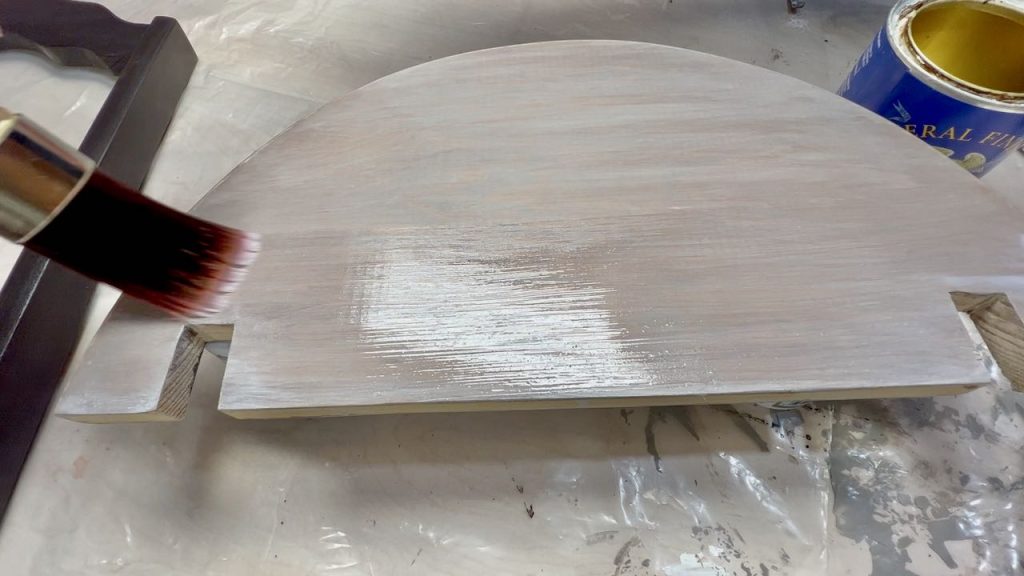
You are a GUI agent. You are given a task and a screenshot of the screen. Output one action in this format:
    pyautogui.click(x=<x>, y=<y>)
    Task: Click on the top of table sleeve
    Image resolution: width=1024 pixels, height=576 pixels.
    Given the screenshot: What is the action you would take?
    pyautogui.click(x=613, y=144)